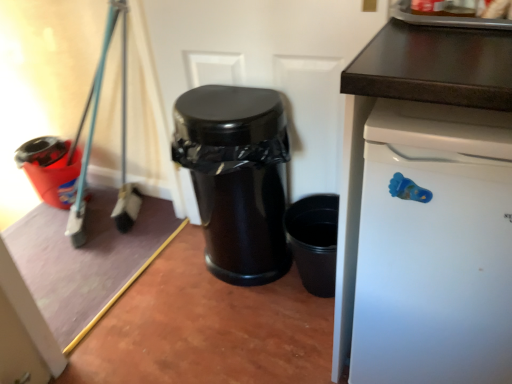
This screenshot has height=384, width=512. What do you see at coordinates (434, 246) in the screenshot?
I see `white matte dishwasher at right` at bounding box center [434, 246].

Identify the location of matte plastic bucket at left, the first waste container viewed from the left. (51, 169).

This screenshot has height=384, width=512. Find the location of `white matte dishwasher at right`. white matte dishwasher at right is located at coordinates (434, 246).

From the picture: Is matte plastic bucket at left, which ranks as the 2th waste container in right-to-left order, looking in the opposite direction of white matte dishwasher at right?

matte plastic bucket at left, which ranks as the 2th waste container in right-to-left order, does not have its back to white matte dishwasher at right.

Between matte plastic bucket at left, placed as the 2th waste container when sorted from front to back, and white matte dishwasher at right, which one has smaller size?

matte plastic bucket at left, placed as the 2th waste container when sorted from front to back, is smaller.

Considering the points (47, 192) and (426, 206), which point is in front, point (47, 192) or point (426, 206)?

The point (426, 206) is more forward.

How many degrees apart are the facing directions of matte plastic bucket at left, which ranks as the 2th waste container in right-to-left order, and white matte dishwasher at right?

They differ by 2.86 degrees in their facing directions.

Identify the location of dish washer above the matte plastic bucket at left, the first waste container viewed from the left (from a real-world perspective). Image resolution: width=512 pixels, height=384 pixels. (x=434, y=246).

From the picture: From the image's perspective, which is below, white matte dishwasher at right or matte plastic bucket at left, the first waste container when ordered from back to front?

white matte dishwasher at right is shown below in the image.

Considering the relative sizes of white matte dishwasher at right and matte plastic bucket at left, the first waste container when ordered from back to front, in the image provided, is white matte dishwasher at right wider than matte plastic bucket at left, the first waste container when ordered from back to front,?

Yes, white matte dishwasher at right is wider than matte plastic bucket at left, the first waste container when ordered from back to front.

Consider the image. Is white matte dishwasher at right positioned with its back to matte plastic bucket at left, the first waste container when ordered from back to front?

No.

Considering the relative sizes of white matte dishwasher at right and glossy black trash can at center, which is the second waste container in back-to-front order, in the image provided, is white matte dishwasher at right taller than glossy black trash can at center, which is the second waste container in back-to-front order,?

Yes.

From a real-world perspective, is white matte dishwasher at right located higher than glossy black trash can at center, which is the second waste container in back-to-front order?

Yes, from a real-world perspective, white matte dishwasher at right is on top of glossy black trash can at center, which is the second waste container in back-to-front order.

The image size is (512, 384). In order to click on dish washer that is below the glossy black trash can at center, which is the 1th waste container in front-to-back order (from the image's perspective) in this screenshot , I will do `click(434, 246)`.

Would you say glossy black trash can at center, the second waste container when ordered from left to right, is part of white matte dishwasher at right's contents?

That's incorrect, glossy black trash can at center, the second waste container when ordered from left to right, is not inside white matte dishwasher at right.

Is glossy black trash can at center, which is the 1th waste container in front-to-back order, completely or partially outside of matte plastic bucket at left, the first waste container when ordered from back to front?

Yes, glossy black trash can at center, which is the 1th waste container in front-to-back order, is outside of matte plastic bucket at left, the first waste container when ordered from back to front.

Is glossy black trash can at center, which is the second waste container in back-to-front order, turned away from matte plastic bucket at left, the first waste container when ordered from back to front?

glossy black trash can at center, which is the second waste container in back-to-front order, is not turned away from matte plastic bucket at left, the first waste container when ordered from back to front.

Are glossy black trash can at center, positioned as the first waste container in right-to-left order, and matte plastic bucket at left, which ranks as the 2th waste container in right-to-left order, far apart?

No, glossy black trash can at center, positioned as the first waste container in right-to-left order, is not far away from matte plastic bucket at left, which ranks as the 2th waste container in right-to-left order.

Does matte plastic bucket at left, the first waste container viewed from the left, have a larger size compared to glossy black trash can at center, which is the 1th waste container in front-to-back order?

Actually, matte plastic bucket at left, the first waste container viewed from the left, might be smaller than glossy black trash can at center, which is the 1th waste container in front-to-back order.

Between matte plastic bucket at left, the first waste container viewed from the left, and glossy black trash can at center, the second waste container when ordered from left to right, which one appears on the left side from the viewer's perspective?

Positioned to the left is matte plastic bucket at left, the first waste container viewed from the left.

Is glossy black trash can at center, which is the second waste container in back-to-front order, completely or partially inside matte plastic bucket at left, which ranks as the 2th waste container in right-to-left order?

Actually, glossy black trash can at center, which is the second waste container in back-to-front order, is outside matte plastic bucket at left, which ranks as the 2th waste container in right-to-left order.

From the image's perspective, is glossy black trash can at center, which is the 1th waste container in front-to-back order, above or below white matte dishwasher at right?

Based on their image positions, glossy black trash can at center, which is the 1th waste container in front-to-back order, is located above white matte dishwasher at right.

Does glossy black trash can at center, the second waste container when ordered from left to right, have a lesser height compared to white matte dishwasher at right?

Yes, glossy black trash can at center, the second waste container when ordered from left to right, is shorter than white matte dishwasher at right.

Considering the points (212, 111) and (437, 320), which point is in front, point (212, 111) or point (437, 320)?

The point (437, 320) is closer.

Is glossy black trash can at center, which is the 1th waste container in front-to-back order, wider or thinner than white matte dishwasher at right?

Considering their sizes, glossy black trash can at center, which is the 1th waste container in front-to-back order, looks slimmer than white matte dishwasher at right.

Where is `dish washer that appears above the matte plastic bucket at left, the first waste container viewed from the left (from a real-world perspective)`? This screenshot has width=512, height=384. dish washer that appears above the matte plastic bucket at left, the first waste container viewed from the left (from a real-world perspective) is located at coordinates (434, 246).

Identify the location of waste container that is the 2nd object located behind the white matte dishwasher at right. (51, 169).

Estimate the real-world distances between objects in this image. Which object is further from glossy black trash can at center, which is the 1th waste container in front-to-back order, matte plastic bucket at left, the first waste container viewed from the left, or white matte dishwasher at right?

matte plastic bucket at left, the first waste container viewed from the left, lies further to glossy black trash can at center, which is the 1th waste container in front-to-back order, than the other object.

Looking at the image, which one is located further to white matte dishwasher at right, glossy black trash can at center, positioned as the first waste container in right-to-left order, or matte plastic bucket at left, the first waste container viewed from the left?

matte plastic bucket at left, the first waste container viewed from the left, is positioned further to the anchor white matte dishwasher at right.

Based on their spatial positions, is matte plastic bucket at left, the first waste container viewed from the left, or glossy black trash can at center, the second waste container when ordered from left to right, further from white matte dishwasher at right?

The object further to white matte dishwasher at right is matte plastic bucket at left, the first waste container viewed from the left.

Looking at the image, which one is located closer to glossy black trash can at center, the second waste container when ordered from left to right, white matte dishwasher at right or matte plastic bucket at left, the first waste container viewed from the left?

white matte dishwasher at right lies closer to glossy black trash can at center, the second waste container when ordered from left to right, than the other object.

Based on their spatial positions, is white matte dishwasher at right or glossy black trash can at center, the second waste container when ordered from left to right, closer to matte plastic bucket at left, placed as the 2th waste container when sorted from front to back?

glossy black trash can at center, the second waste container when ordered from left to right, is positioned closer to the anchor matte plastic bucket at left, placed as the 2th waste container when sorted from front to back.

Looking at the image, which one is located further to matte plastic bucket at left, the first waste container viewed from the left, glossy black trash can at center, the second waste container when ordered from left to right, or white matte dishwasher at right?

Among the two, white matte dishwasher at right is located further to matte plastic bucket at left, the first waste container viewed from the left.

Locate an element on the screen. waste container between matte plastic bucket at left, the first waste container when ordered from back to front, and white matte dishwasher at right, in the horizontal direction is located at coordinates pos(236,178).